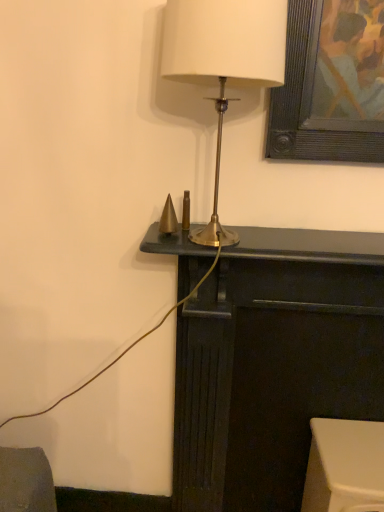
Where is `white plastic stool at lower right, placed as the 2th furniture when sorted from left to right`? Image resolution: width=384 pixels, height=512 pixels. white plastic stool at lower right, placed as the 2th furniture when sorted from left to right is located at coordinates (345, 466).

You are a GUI agent. You are given a task and a screenshot of the screen. Output one action in this format:
    pyautogui.click(x=<x>, y=<y>)
    Task: Click on the white plastic stool at lower right, the 1th furniture from the right
    Image resolution: width=384 pixels, height=512 pixels.
    Given the screenshot: What is the action you would take?
    pyautogui.click(x=345, y=466)

Is point (220, 140) farther from camera compared to point (262, 300)?

No, (220, 140) is in front of (262, 300).

How much distance is there between matte gold lamp at center and dark wood fireplace at center, which ranks as the first furniture in left-to-right order?

matte gold lamp at center and dark wood fireplace at center, which ranks as the first furniture in left-to-right order, are 18.48 inches apart from each other.

From the picture: Choose the correct answer: Is matte gold lamp at center inside dark wood fireplace at center, the 2th furniture when ordered from right to left, or outside it?

matte gold lamp at center is located beyond the bounds of dark wood fireplace at center, the 2th furniture when ordered from right to left.

Looking at this image, does matte gold lamp at center have a lesser height compared to dark wood fireplace at center, the 2th furniture when ordered from right to left?

Yes, matte gold lamp at center is shorter than dark wood fireplace at center, the 2th furniture when ordered from right to left.

From a real-world perspective, which is physically below, dark wood fireplace at center, which ranks as the first furniture in left-to-right order, or white plastic stool at lower right, the 1th furniture from the right?

white plastic stool at lower right, the 1th furniture from the right, from a real-world perspective.

Is dark wood fireplace at center, the 2th furniture when ordered from right to left, oriented towards white plastic stool at lower right, placed as the 2th furniture when sorted from left to right?

Yes, dark wood fireplace at center, the 2th furniture when ordered from right to left, is oriented towards white plastic stool at lower right, placed as the 2th furniture when sorted from left to right.

Can you tell me how much dark wood fireplace at center, the 2th furniture when ordered from right to left, and white plastic stool at lower right, the 1th furniture from the right, differ in facing direction?

They differ by 0.402 degrees in their facing directions.

Considering the relative positions of dark wood fireplace at center, the 2th furniture when ordered from right to left, and white plastic stool at lower right, the 1th furniture from the right, in the image provided, is dark wood fireplace at center, the 2th furniture when ordered from right to left, to the left or to the right of white plastic stool at lower right, the 1th furniture from the right,?

Clearly, dark wood fireplace at center, the 2th furniture when ordered from right to left, is on the left of white plastic stool at lower right, the 1th furniture from the right, in the image.

Looking at their sizes, would you say white plastic stool at lower right, placed as the 2th furniture when sorted from left to right, is wider or thinner than dark wood fireplace at center, which ranks as the first furniture in left-to-right order?

white plastic stool at lower right, placed as the 2th furniture when sorted from left to right, is wider than dark wood fireplace at center, which ranks as the first furniture in left-to-right order.

Considering the relative positions of white plastic stool at lower right, the 1th furniture from the right, and dark wood fireplace at center, which ranks as the first furniture in left-to-right order, in the image provided, is white plastic stool at lower right, the 1th furniture from the right, to the right of dark wood fireplace at center, which ranks as the first furniture in left-to-right order, from the viewer's perspective?

Yes.

Which object is closer to the camera, white plastic stool at lower right, placed as the 2th furniture when sorted from left to right, or dark wood fireplace at center, the 2th furniture when ordered from right to left?

dark wood fireplace at center, the 2th furniture when ordered from right to left, is closer to the camera.

Would you consider white plastic stool at lower right, placed as the 2th furniture when sorted from left to right, to be distant from dark wood fireplace at center, which ranks as the first furniture in left-to-right order?

No, white plastic stool at lower right, placed as the 2th furniture when sorted from left to right, is in close proximity to dark wood fireplace at center, which ranks as the first furniture in left-to-right order.

From a real-world perspective, does dark wood fireplace at center, the 2th furniture when ordered from right to left, sit lower than matte gold lamp at center?

Yes.

Looking at this image, is dark wood fireplace at center, the 2th furniture when ordered from right to left, touching matte gold lamp at center?

dark wood fireplace at center, the 2th furniture when ordered from right to left, is not next to matte gold lamp at center, and they're not touching.

There is a matte gold lamp at center. At what (x,y) coordinates should I click in order to perform the action: click on the 1st furniture below it (from a real-world perspective). Please return your answer as a coordinate pair (x, y). The image size is (384, 512). Looking at the image, I should click on (274, 362).

Is dark wood fireplace at center, which ranks as the first furniture in left-to-right order, wider or thinner than matte gold lamp at center?

In the image, dark wood fireplace at center, which ranks as the first furniture in left-to-right order, appears to be more narrow than matte gold lamp at center.

From the image's perspective, is white plastic stool at lower right, placed as the 2th furniture when sorted from left to right, positioned above or below matte gold lamp at center?

white plastic stool at lower right, placed as the 2th furniture when sorted from left to right, is below matte gold lamp at center.

Between white plastic stool at lower right, placed as the 2th furniture when sorted from left to right, and matte gold lamp at center, which one has smaller size?

Smaller between the two is white plastic stool at lower right, placed as the 2th furniture when sorted from left to right.

Measure the distance between white plastic stool at lower right, the 1th furniture from the right, and matte gold lamp at center.

white plastic stool at lower right, the 1th furniture from the right, and matte gold lamp at center are 81.68 centimeters apart.

What's the angular difference between white plastic stool at lower right, the 1th furniture from the right, and matte gold lamp at center's facing directions?

The angular difference between white plastic stool at lower right, the 1th furniture from the right, and matte gold lamp at center is 0.000172 degrees.

Is matte gold lamp at center not inside white plastic stool at lower right, placed as the 2th furniture when sorted from left to right?

matte gold lamp at center is positioned outside white plastic stool at lower right, placed as the 2th furniture when sorted from left to right.

Consider the image. In the image, is matte gold lamp at center positioned in front of or behind white plastic stool at lower right, the 1th furniture from the right?

matte gold lamp at center is positioned closer to the viewer than white plastic stool at lower right, the 1th furniture from the right.

Can you confirm if matte gold lamp at center is thinner than white plastic stool at lower right, the 1th furniture from the right?

Yes.

Between matte gold lamp at center and white plastic stool at lower right, the 1th furniture from the right, which one has larger size?

matte gold lamp at center is bigger.

You are a GUI agent. You are given a task and a screenshot of the screen. Output one action in this format:
    pyautogui.click(x=<x>, y=<y>)
    Task: Click on the furniture that is the 1st one when counting backward from the matte gold lamp at center
    The width and height of the screenshot is (384, 512).
    Given the screenshot: What is the action you would take?
    pyautogui.click(x=274, y=362)

Locate an element on the screen. This screenshot has width=384, height=512. furniture below the dark wood fireplace at center, the 2th furniture when ordered from right to left (from a real-world perspective) is located at coordinates (345, 466).

Estimate the real-world distances between objects in this image. Which object is closer to matte gold lamp at center, dark wood fireplace at center, the 2th furniture when ordered from right to left, or white plastic stool at lower right, the 1th furniture from the right?

The object closer to matte gold lamp at center is dark wood fireplace at center, the 2th furniture when ordered from right to left.

In the scene shown: Based on their spatial positions, is matte gold lamp at center or dark wood fireplace at center, the 2th furniture when ordered from right to left, closer to white plastic stool at lower right, placed as the 2th furniture when sorted from left to right?

dark wood fireplace at center, the 2th furniture when ordered from right to left, is closer to white plastic stool at lower right, placed as the 2th furniture when sorted from left to right.

Estimate the real-world distances between objects in this image. Which object is closer to dark wood fireplace at center, the 2th furniture when ordered from right to left, matte gold lamp at center or white plastic stool at lower right, the 1th furniture from the right?

Among the two, white plastic stool at lower right, the 1th furniture from the right, is located nearer to dark wood fireplace at center, the 2th furniture when ordered from right to left.

Considering their positions, is white plastic stool at lower right, the 1th furniture from the right, positioned further to matte gold lamp at center than dark wood fireplace at center, which ranks as the first furniture in left-to-right order?

white plastic stool at lower right, the 1th furniture from the right, is further to matte gold lamp at center.

Considering their positions, is dark wood fireplace at center, which ranks as the first furniture in left-to-right order, positioned further to white plastic stool at lower right, placed as the 2th furniture when sorted from left to right, than matte gold lamp at center?

matte gold lamp at center lies further to white plastic stool at lower right, placed as the 2th furniture when sorted from left to right, than the other object.

From the image, which object appears to be farther from dark wood fireplace at center, the 2th furniture when ordered from right to left, white plastic stool at lower right, placed as the 2th furniture when sorted from left to right, or matte gold lamp at center?

Among the two, matte gold lamp at center is located further to dark wood fireplace at center, the 2th furniture when ordered from right to left.

Where is `furniture between matte gold lamp at center and white plastic stool at lower right, the 1th furniture from the right, vertically`? The height and width of the screenshot is (512, 384). furniture between matte gold lamp at center and white plastic stool at lower right, the 1th furniture from the right, vertically is located at coordinates (274, 362).